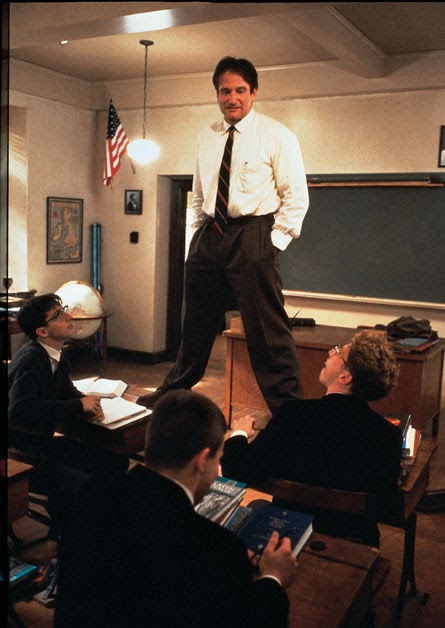
This screenshot has width=445, height=628. Identify the location of blackboard. (358, 247).